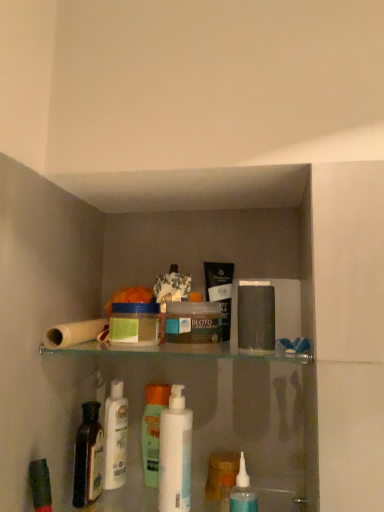
Question: Can you confirm if dark brown glass bottle at lower left is positioned to the right of translucent plastic bottle at lower center, the 2th mouthwash in the back-to-front sequence?

Choices:
 (A) yes
 (B) no

Answer: (B)

Question: Considering the relative sizes of dark brown glass bottle at lower left and translucent plastic bottle at lower center, which ranks as the 1th mouthwash in front-to-back order, in the image provided, is dark brown glass bottle at lower left bigger than translucent plastic bottle at lower center, which ranks as the 1th mouthwash in front-to-back order,?

Choices:
 (A) no
 (B) yes

Answer: (A)

Question: Considering the relative sizes of dark brown glass bottle at lower left and translucent plastic bottle at lower center, the 1th mouthwash from the right, in the image provided, is dark brown glass bottle at lower left shorter than translucent plastic bottle at lower center, the 1th mouthwash from the right,?

Choices:
 (A) yes
 (B) no

Answer: (B)

Question: From a real-world perspective, does dark brown glass bottle at lower left sit lower than translucent plastic bottle at lower center, the 2th mouthwash in the back-to-front sequence?

Choices:
 (A) no
 (B) yes

Answer: (A)

Question: Is translucent plastic bottle at lower center, which ranks as the 1th mouthwash in front-to-back order, inside dark brown glass bottle at lower left?

Choices:
 (A) yes
 (B) no

Answer: (B)

Question: From a real-world perspective, is dark brown glass bottle at lower left physically above translucent plastic bottle at lower center, the 2th mouthwash in the back-to-front sequence?

Choices:
 (A) yes
 (B) no

Answer: (A)

Question: Is green matte jar at center, the 1th product in the left-to-right sequence, located within translucent plastic bottle at center, positioned as the 1th toiletry in back-to-front order?

Choices:
 (A) yes
 (B) no

Answer: (B)

Question: Is translucent plastic bottle at center, acting as the first toiletry starting from the left, positioned with its back to green matte jar at center, which appears as the 2th product when viewed from the right?

Choices:
 (A) yes
 (B) no

Answer: (B)

Question: Is translucent plastic bottle at center, acting as the first toiletry starting from the left, positioned far away from green matte jar at center, the 1th product in the left-to-right sequence?

Choices:
 (A) yes
 (B) no

Answer: (B)

Question: From a real-world perspective, is translucent plastic bottle at center, the 2th toiletry in the right-to-left sequence, beneath green matte jar at center, which appears as the 2th product when viewed from the right?

Choices:
 (A) no
 (B) yes

Answer: (B)

Question: Is translucent plastic bottle at center, the 2th toiletry in the right-to-left sequence, further to camera compared to green matte jar at center, the 1th product in the left-to-right sequence?

Choices:
 (A) no
 (B) yes

Answer: (B)

Question: From a real-world perspective, is translucent plastic bottle at center, which appears as the 2th toiletry when viewed from the front, over green matte jar at center, the 1th product in the left-to-right sequence?

Choices:
 (A) yes
 (B) no

Answer: (B)

Question: From a real-world perspective, is translucent plastic container at center, which is counted as the second product, starting from the left, under white glossy mouthwash at center, the 2th mouthwash positioned from the front?

Choices:
 (A) yes
 (B) no

Answer: (B)